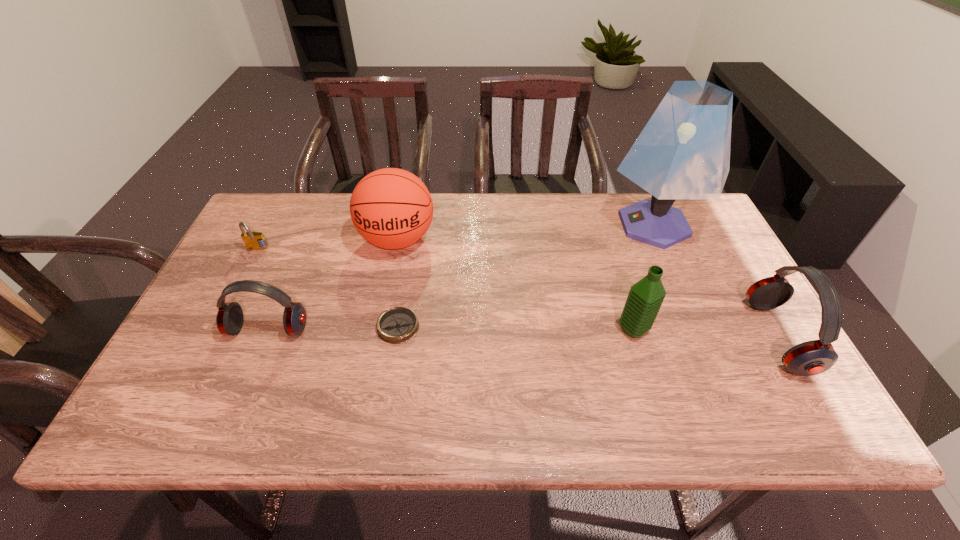
I want to click on blank space located 0.330m on the base of the tallest object, so click(496, 225).

You are a GUI agent. You are given a task and a screenshot of the screen. Output one action in this format:
    pyautogui.click(x=<x>, y=<y>)
    Task: Click on the blank space located 0.230m on the base of the tallest object
    Image resolution: width=960 pixels, height=540 pixels.
    Given the screenshot: What is the action you would take?
    pyautogui.click(x=528, y=225)

Identify the location of vacant space located 0.290m on the side with the combination dials of the padlock. The height and width of the screenshot is (540, 960). (213, 336).

Find the location of `vacant region located on the side with logo of the basketball`. vacant region located on the side with logo of the basketball is located at coordinates (370, 383).

Locate an element on the screen. vacant space located on the left of the shortest object is located at coordinates (252, 327).

I want to click on blank area located 0.280m on the left of the water bottle, so click(503, 330).

Where is `lampshade that is at the far edge`? The height and width of the screenshot is (540, 960). lampshade that is at the far edge is located at coordinates (683, 152).

The image size is (960, 540). I want to click on basketball that is at the far edge, so click(x=391, y=208).

Find the location of a particular element. object located in the near edge section of the desktop is located at coordinates (813, 357).

The width and height of the screenshot is (960, 540). What are the coordinates of `earphone at the left edge` in the screenshot? It's located at (229, 319).